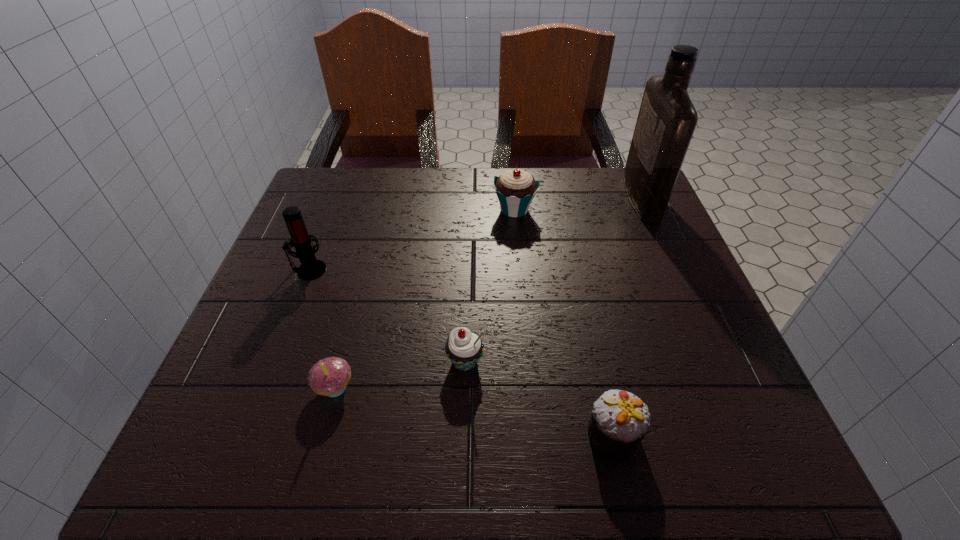
Identify the location of object that is at the near edge. The height and width of the screenshot is (540, 960). coord(620,420).

This screenshot has height=540, width=960. In order to click on object at the left edge in this screenshot , I will do `click(310, 268)`.

Find the location of a particular element. This screenshot has height=540, width=960. object situated at the right edge is located at coordinates (667, 118).

Locate an element on the screen. object located at the far right corner is located at coordinates (667, 118).

You are a GUI agent. You are given a task and a screenshot of the screen. Output one action in this format:
    pyautogui.click(x=<x>, y=<y>)
    Task: Click on the vacant area at the far edge
    The image size is (960, 540).
    Given the screenshot: What is the action you would take?
    pyautogui.click(x=420, y=170)

In the image, there is a desktop. Identify the location of free region at the near edge. The width and height of the screenshot is (960, 540). (395, 469).

At what (x,y) coordinates should I click in order to perform the action: click on vacant area at the left edge of the desktop. Please return your answer as a coordinate pair (x, y). This screenshot has width=960, height=540. Looking at the image, I should click on [x=351, y=224].

This screenshot has height=540, width=960. In the image, there is a desktop. What are the coordinates of `vacant space at the right edge` in the screenshot? It's located at (660, 342).

In the image, there is a desktop. What are the coordinates of `free region at the far left corner` in the screenshot? It's located at (327, 202).

Locate an element on the screen. Image resolution: width=960 pixels, height=540 pixels. vacant region at the near left corner is located at coordinates (289, 437).